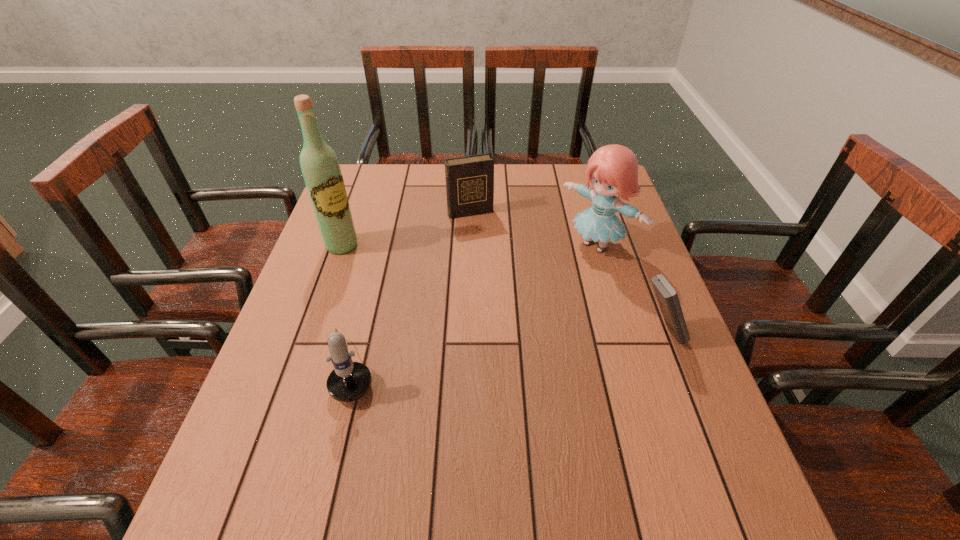
I want to click on doll positioned at the right edge, so click(612, 169).

The height and width of the screenshot is (540, 960). Identify the location of vacant space at the far edge. (416, 172).

Where is `vacant space at the near edge`? vacant space at the near edge is located at coordinates (613, 452).

You are a GUI agent. You are given a task and a screenshot of the screen. Output one action in this format:
    pyautogui.click(x=<x>, y=<y>)
    Task: Click on the vacant space at the left edge
    This screenshot has width=960, height=540.
    Given the screenshot: What is the action you would take?
    coord(308,363)

This screenshot has width=960, height=540. Find the location of `vacant point at the right edge`. vacant point at the right edge is located at coordinates (616, 340).

Find the location of `free region at the far left corner of the desktop`. free region at the far left corner of the desktop is located at coordinates (363, 198).

The height and width of the screenshot is (540, 960). Identify the location of blank region between the calculator and the second object from left to right. (506, 349).

Find the location of a particular element. The height and width of the screenshot is (540, 960). unoccupied area between the farthest object and the calculator is located at coordinates (565, 272).

Where is `free space between the fourth object from right to left and the farthest object`? free space between the fourth object from right to left and the farthest object is located at coordinates (411, 288).

The height and width of the screenshot is (540, 960). What are the coordinates of `vacant space in between the wine bottle and the farthest object` in the screenshot? It's located at (406, 228).